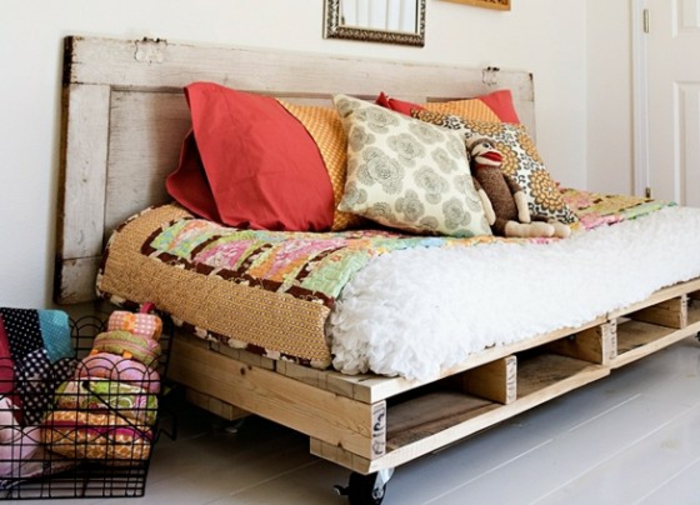
Image resolution: width=700 pixels, height=505 pixels. What are the coordinates of `side bed frame` in the screenshot? It's located at (210, 384).